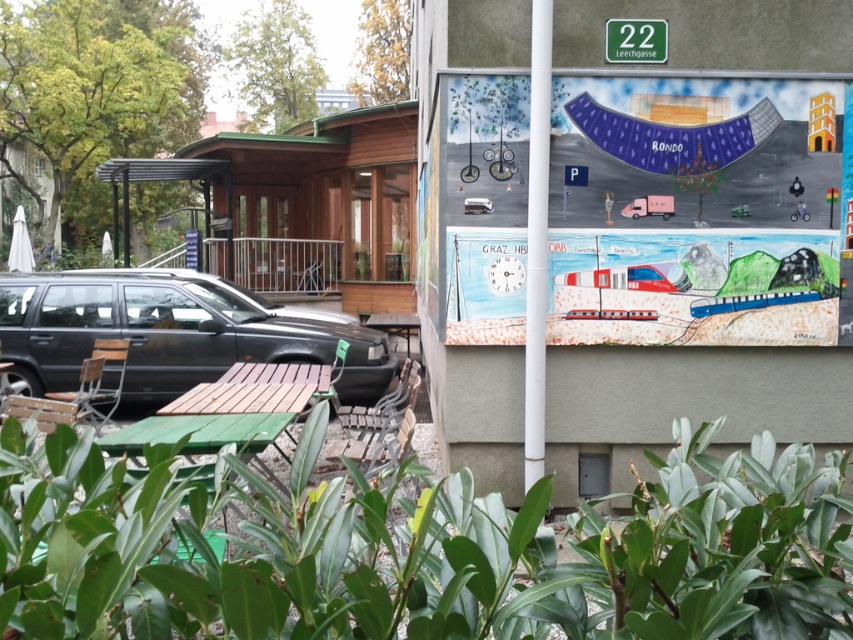
You are standing at the origin point in the image. Where is the metallic silver bench at center located in terms of coordinates?

The metallic silver bench at center is located at coordinates (379, 426).

You are standing in the outdoor urban scene and want to walk from point A to point B. Point A is at coordinates point (369, 452) and point B is at coordinates point (659, 61). Which point is closer to you when you start walking?

Point A at coordinates point (369, 452) is closer to you because it is further to the camera than point B at coordinates point (659, 61), meaning it is physically nearer in the scene.